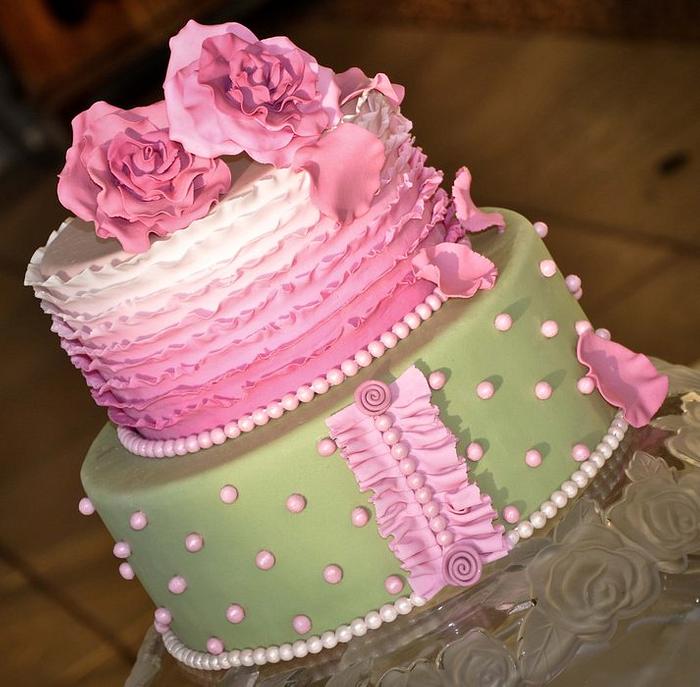
Where is `pink pearl decor`? The image size is (700, 687). pink pearl decor is located at coordinates (290, 501).